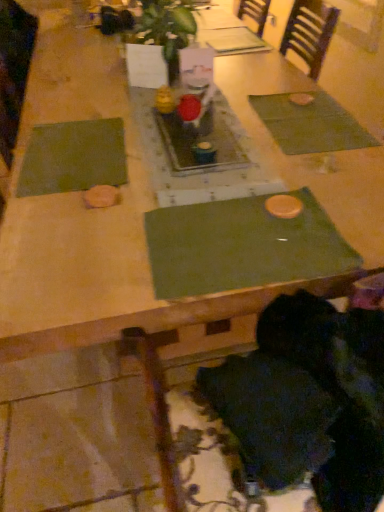
In order to click on free area in between green fabric place mat at left, which ranks as the 1th place mat in left-to-right order, and green fabric place mat at center, which appears as the second place mat when viewed from the left in this screenshot , I will do `click(145, 190)`.